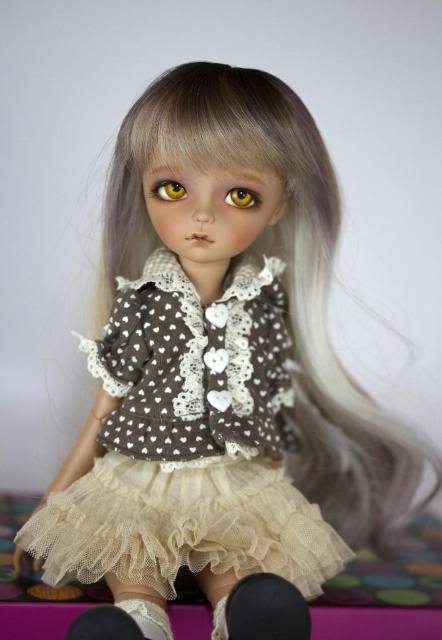
Based on the photo, does white lace dress at center appear under brown glossy eye at center?

Yes.

You are a GUI agent. You are given a task and a screenshot of the screen. Output one action in this format:
    pyautogui.click(x=<x>, y=<y>)
    Task: Click on the white lace dress at center
    Image resolution: width=442 pixels, height=640 pixels.
    Given the screenshot: What is the action you would take?
    click(189, 444)

Image resolution: width=442 pixels, height=640 pixels. I want to click on white lace dress at center, so click(189, 444).

How much distance is there between brown glossy eye at upper center and brown glossy eye at center?

brown glossy eye at upper center is 2.98 inches from brown glossy eye at center.

Locate an element on the screen. brown glossy eye at upper center is located at coordinates (168, 189).

Can you confirm if white lace dress at center is wider than brown glossy eye at upper center?

Yes, white lace dress at center is wider than brown glossy eye at upper center.

Which is more to the left, white lace dress at center or brown glossy eye at upper center?

Positioned to the left is brown glossy eye at upper center.

Is point (251, 435) positioned in front of point (167, 188)?

No, (251, 435) is behind (167, 188).

The height and width of the screenshot is (640, 442). Find the location of `white lace dress at center`. white lace dress at center is located at coordinates (189, 444).